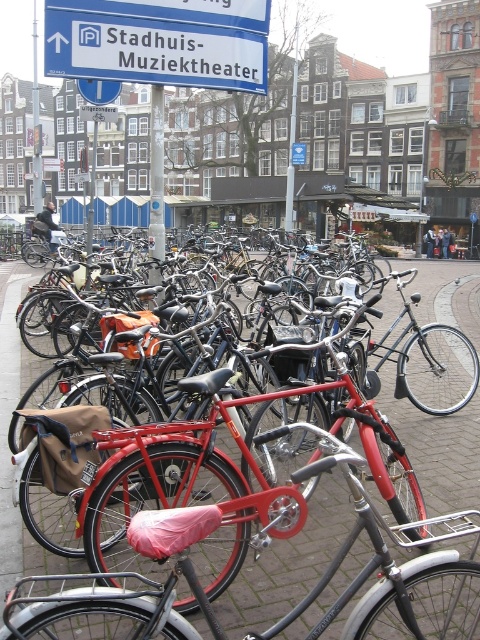
Question: Which object is closer to the camera taking this photo?

Choices:
 (A) blue plastic sign at upper center
 (B) brick pavement at center
 (C) metallic pole at upper center

Answer: (B)

Question: From the image, what is the correct spatial relationship of blue plastic sign at upper center in relation to metallic pole at upper center?

Choices:
 (A) left
 (B) right

Answer: (B)

Question: Does blue plastic sign at upper center appear on the left side of brick pavement at center?

Choices:
 (A) no
 (B) yes

Answer: (B)

Question: Which of the following is the closest to the observer?

Choices:
 (A) metallic pole at upper center
 (B) brick pavement at center
 (C) metallic pole at center

Answer: (B)

Question: Which object is positioned closest to the brick pavement at center?

Choices:
 (A) blue plastic sign at upper center
 (B) metallic pole at upper center
 (C) metallic pole at center

Answer: (A)

Question: Is metallic pole at center wider than metallic pole at upper center?

Choices:
 (A) no
 (B) yes

Answer: (A)